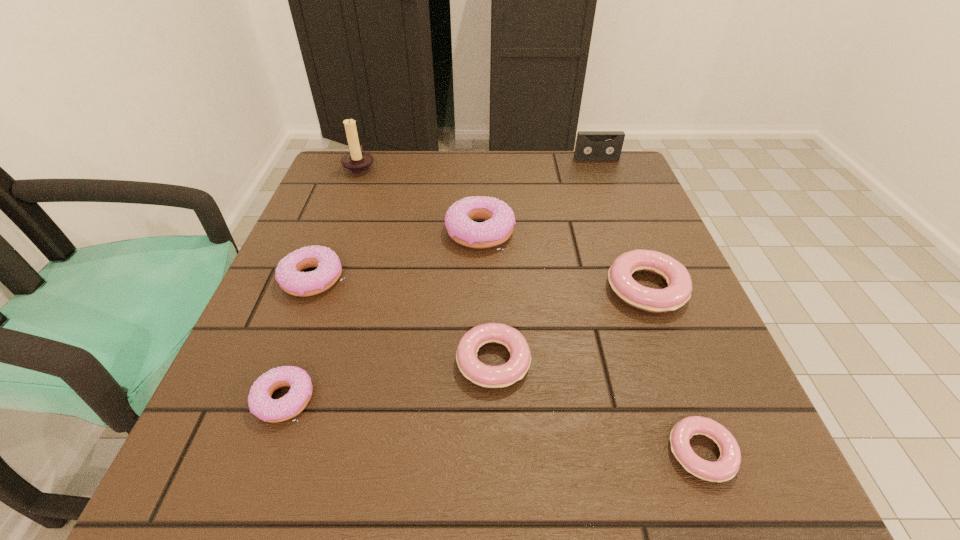
Find the location of `candle holder positioned at the far edge`. candle holder positioned at the far edge is located at coordinates (357, 162).

Where is `videotape at the far edge`? The height and width of the screenshot is (540, 960). videotape at the far edge is located at coordinates (590, 145).

In order to click on object located at the near edge in this screenshot , I will do `click(725, 468)`.

Locate an element on the screen. The height and width of the screenshot is (540, 960). candle holder that is at the left edge is located at coordinates (357, 162).

Locate an element on the screen. This screenshot has height=540, width=960. videotape positioned at the right edge is located at coordinates (590, 145).

This screenshot has width=960, height=540. Find the location of `object situated at the far left corner`. object situated at the far left corner is located at coordinates (357, 162).

Find the location of a particular element. Image resolution: width=960 pixels, height=540 pixels. object positioned at the far right corner is located at coordinates click(590, 145).

Image resolution: width=960 pixels, height=540 pixels. I want to click on object located in the near right corner section of the desktop, so click(x=725, y=468).

In the image, there is a desktop. In order to click on vacant space at the far edge in this screenshot , I will do `click(545, 177)`.

At what (x,y) coordinates should I click in order to perform the action: click on vacant area at the left edge of the desktop. Please return your answer as a coordinate pair (x, y). Looking at the image, I should click on (326, 224).